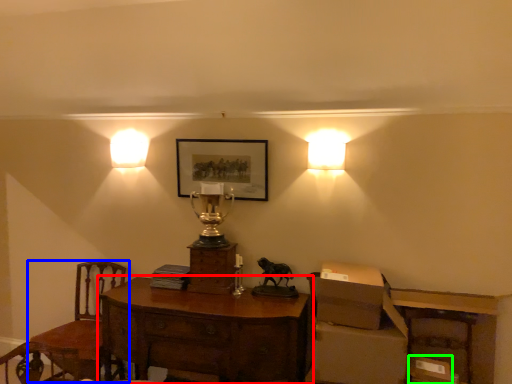
Question: Estimate the real-world distances between objects in this image. Which object is closer to desk (highlighted by a red box), chair (highlighted by a blue box) or cardboard box (highlighted by a green box)?

Choices:
 (A) chair
 (B) cardboard box

Answer: (A)